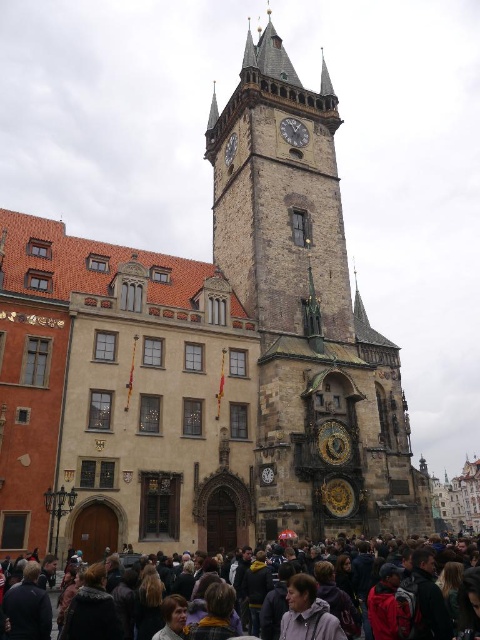
You are a photographer trying to capture both the dark gray clothing at lower center and the dark gray stone clock at upper center in a single frame. Since the camera has a limited field of view, you need to know which object is wider. Which one should you adjust your focus on to ensure both are in the frame?

The dark gray clothing at lower center is wider than the dark gray stone clock at upper center. To ensure both are in the frame, focus on the dark gray clothing at lower center first, as it requires more space.

You are standing in front of the historic building and want to take a photo of both the dark gray metallic clock at center and the dark gray stone clock at upper center. Which clock should you position to the left side of your camera frame to include both in the photo?

You should position the dark gray stone clock at upper center to the left side of your camera frame because the dark gray metallic clock at center is to the right of it, ensuring both are captured in the photo.

You are a tourist standing in front of the historic building. You want to take a photo that includes both the stone clock tower at center and the dark gray metallic clock at center. Which object should you focus on first to ensure both are in the frame?

You should focus on the stone clock tower at center first because it is larger than the dark gray metallic clock at center, so centering it will help include both in the frame.